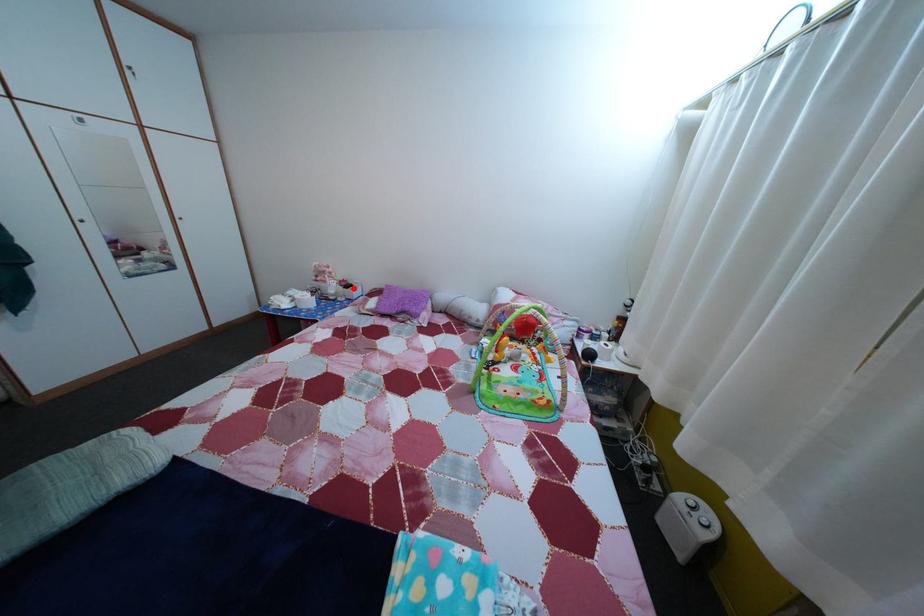
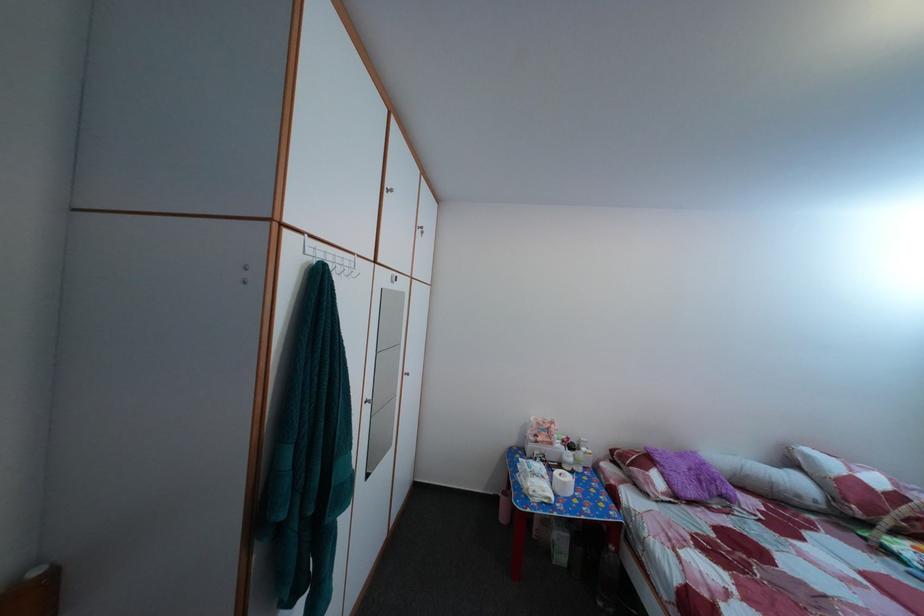
Question: I am providing you with two images of the same scene from different viewpoints. In image1, a red point is highlighted. Considering the same 3D point in image2, which of the following is correct?

Choices:
 (A) It is closer
 (B) It is farther

Answer: (B)